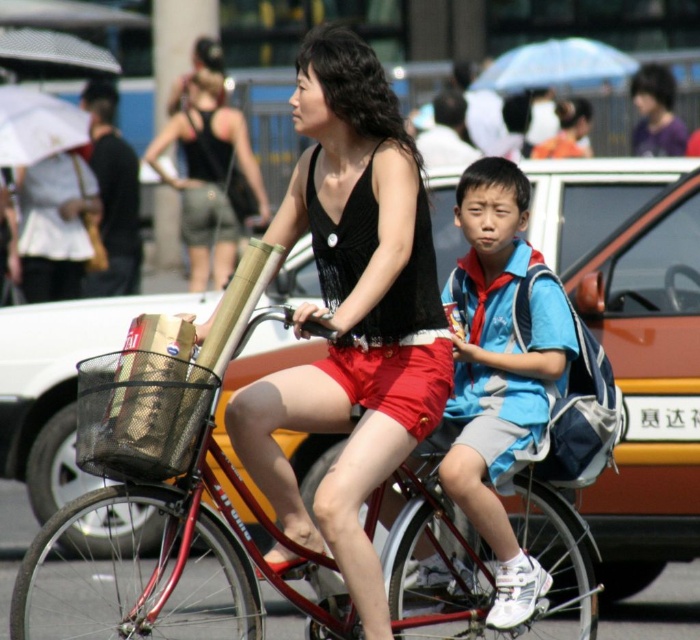
Question: Can you confirm if metallic red bicycle at center is wider than black matte tank top at center?

Choices:
 (A) no
 (B) yes

Answer: (B)

Question: Which object is farther from the camera taking this photo?

Choices:
 (A) metallic red bicycle at center
 (B) metallic pole at upper center
 (C) black matte tank top at center

Answer: (B)

Question: Can you confirm if black matte tank top at center is positioned below metallic pole at upper center?

Choices:
 (A) no
 (B) yes

Answer: (B)

Question: Among these objects, which one is farthest from the camera?

Choices:
 (A) black matte tank top at center
 (B) metallic red bicycle at center

Answer: (A)

Question: Is black matte tank top at center thinner than metallic pole at upper center?

Choices:
 (A) yes
 (B) no

Answer: (B)

Question: Which point appears closest to the camera in this image?

Choices:
 (A) (x=393, y=451)
 (B) (x=158, y=202)
 (C) (x=578, y=536)

Answer: (A)